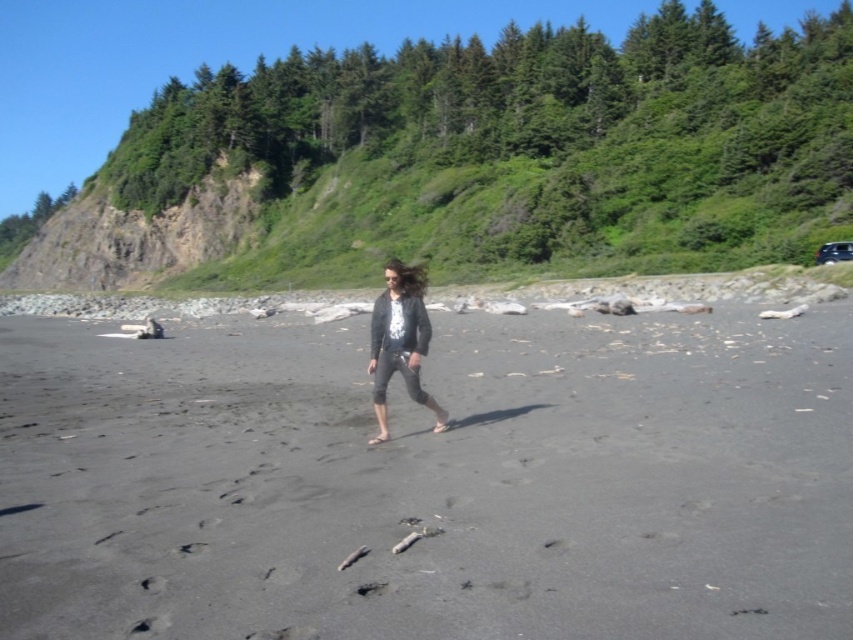
Question: Based on their relative distances, which object is farther from the dark gray knit sweater at center?

Choices:
 (A) green leafy hillside at upper center
 (B) dark gray sand at center

Answer: (A)

Question: Considering the real-world distances, which object is closest to the dark gray knit sweater at center?

Choices:
 (A) green leafy hillside at upper center
 (B) dark gray sand at center

Answer: (B)

Question: Does dark gray sand at center appear on the left side of dark gray knit sweater at center?

Choices:
 (A) yes
 (B) no

Answer: (A)

Question: Does green leafy hillside at upper center appear over dark gray knit sweater at center?

Choices:
 (A) no
 (B) yes

Answer: (B)

Question: Can you confirm if dark gray sand at center is bigger than green leafy hillside at upper center?

Choices:
 (A) yes
 (B) no

Answer: (B)

Question: Among these objects, which one is nearest to the camera?

Choices:
 (A) green leafy hillside at upper center
 (B) dark gray knit sweater at center
 (C) dark gray sand at center

Answer: (C)